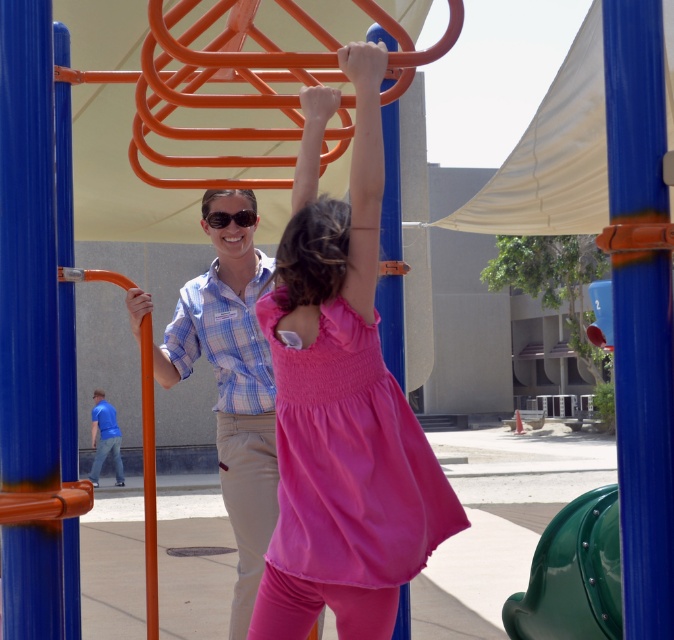
Who is more forward, (400, 355) or (249, 211)?

Point (249, 211) is more forward.

Is orange matte pole at upper center positioned before matte black sunglasses at center?

Yes, orange matte pole at upper center is closer to the viewer.

The image size is (674, 640). What are the coordinates of `orange matte pole at upper center` in the screenshot? It's located at (390, 186).

Is blue plastic pole at center behind blue plaid shirt at center?

No, it is in front of blue plaid shirt at center.

Which of these two, blue plastic pole at center or blue plaid shirt at center, stands shorter?

Standing shorter between the two is blue plastic pole at center.

At what (x,y) coordinates should I click in order to perform the action: click on blue plastic pole at center. Please return your answer as a coordinate pair (x, y). The width and height of the screenshot is (674, 640). Looking at the image, I should click on (640, 308).

Does pink fabric dress at center appear over blue plastic pole at center?

No, pink fabric dress at center is not above blue plastic pole at center.

Who is positioned more to the right, pink fabric dress at center or blue plastic pole at center?

blue plastic pole at center

You are a GUI agent. You are given a task and a screenshot of the screen. Output one action in this format:
    pyautogui.click(x=<x>, y=<y>)
    Task: Click on the pink fabric dress at center
    Image resolution: width=674 pixels, height=640 pixels.
    Given the screenshot: What is the action you would take?
    pyautogui.click(x=340, y=401)